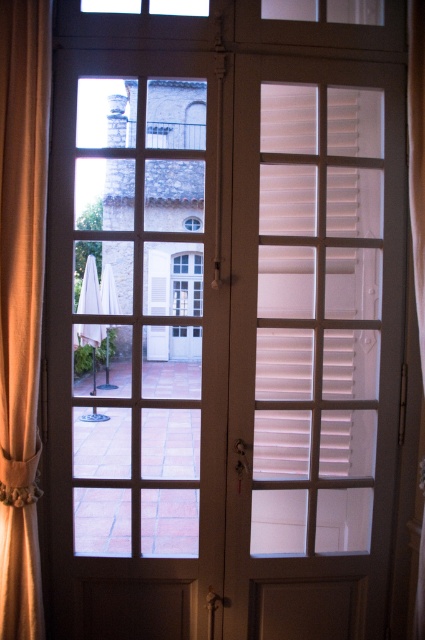
You are a delivery person who needs to enter the room through the French doors. The doors require a clearance of 2 meters to open fully. Can you open the doors completely without any obstruction from the beige fabric curtain at right?

The beige fabric curtain at right is 1.92 meters away from the viewer, which is less than the required 2 meters clearance. Therefore, opening the doors fully may cause the curtain to obstruct the opening path.